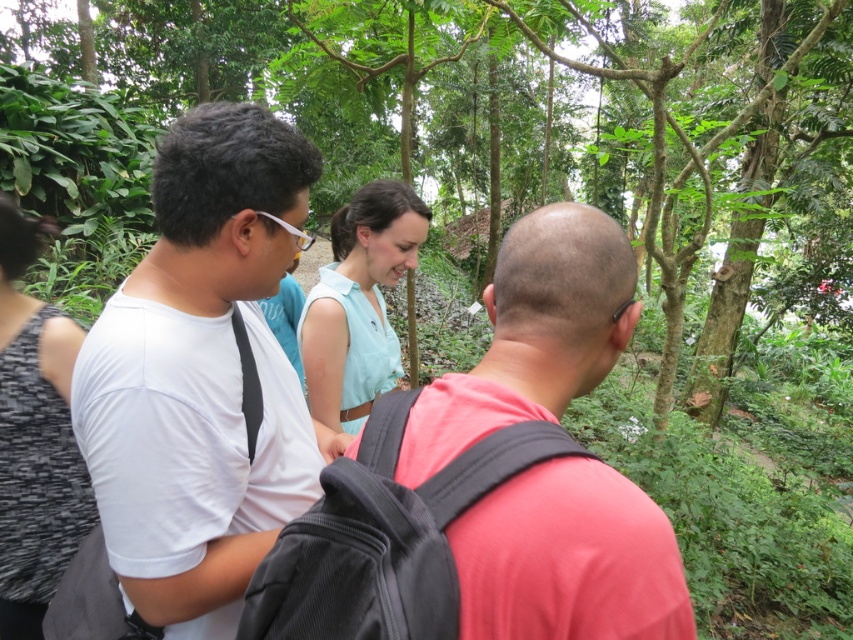
Question: Does white matte shirt at center appear on the left side of pink matte shirt at center?

Choices:
 (A) no
 (B) yes

Answer: (B)

Question: Which of the following is the closest to the observer?

Choices:
 (A) pink matte shirt at center
 (B) green leafy tree at center

Answer: (A)

Question: Can you confirm if green leafy tree at center is positioned below pink matte shirt at center?

Choices:
 (A) yes
 (B) no

Answer: (B)

Question: Is green leafy tree at center below white matte shirt at center?

Choices:
 (A) yes
 (B) no

Answer: (B)

Question: Which point is farther from the camera taking this photo?

Choices:
 (A) (204, 593)
 (B) (570, 253)

Answer: (A)

Question: Estimate the real-world distances between objects in this image. Which object is closer to the white matte shirt at center?

Choices:
 (A) green leafy tree at center
 (B) pink matte shirt at center

Answer: (B)